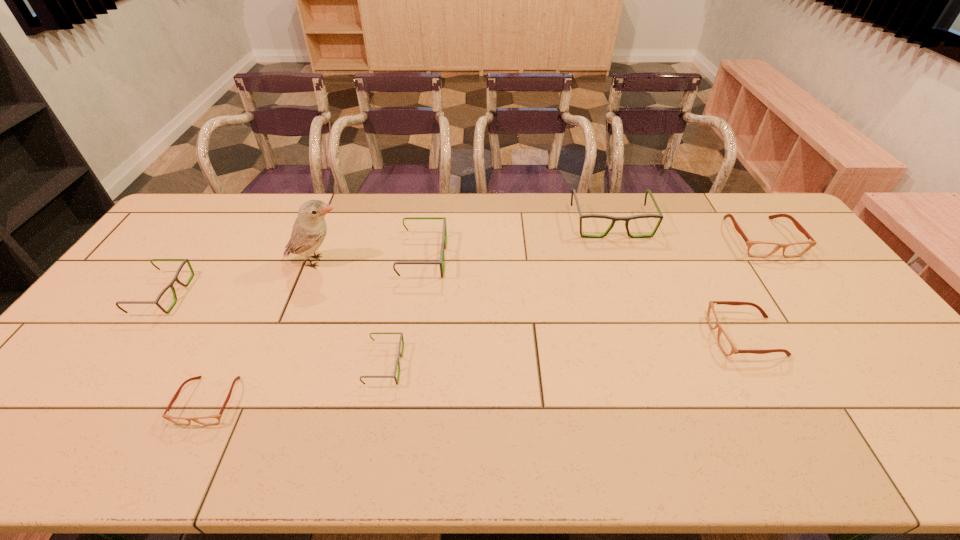
This screenshot has width=960, height=540. I want to click on the second brown spectacles from left to right, so click(x=726, y=345).

The image size is (960, 540). Find the location of `the smallest black spectacles`. the smallest black spectacles is located at coordinates (400, 354).

This screenshot has height=540, width=960. Find the location of `the shortest spectacles`. the shortest spectacles is located at coordinates (213, 419).

You are a GUI agent. You are given a task and a screenshot of the screen. Output one action in this format:
    pyautogui.click(x=<x>, y=<y>)
    Task: Click on the second spectacles from left to right
    
    Given the screenshot: What is the action you would take?
    pyautogui.click(x=213, y=419)

The width and height of the screenshot is (960, 540). In order to click on free space located 0.230m at the face of the tallest object in this screenshot , I will do `click(420, 261)`.

Find the location of a particular element. vacant space located on the lens of the rightmost black spectacles is located at coordinates (x=626, y=266).

This screenshot has width=960, height=540. I want to click on free location located on the lens of the second biggest black spectacles, so click(x=504, y=257).

Identify the location of vacant space located 0.190m on the front-facing side of the rightmost object. tap(807, 303).

The height and width of the screenshot is (540, 960). In order to click on free region located 0.060m on the lens of the leftmost black spectacles in this screenshot , I will do `click(203, 294)`.

Identify the location of free space located on the front-facing side of the second object from right to left. (605, 336).